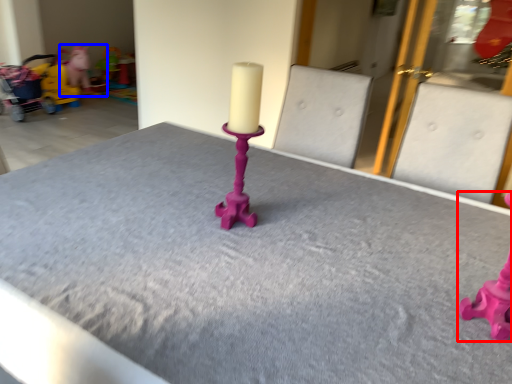
Question: Which object is further to the camera taking this photo, toy (highlighted by a red box) or toy (highlighted by a blue box)?

Choices:
 (A) toy
 (B) toy

Answer: (B)